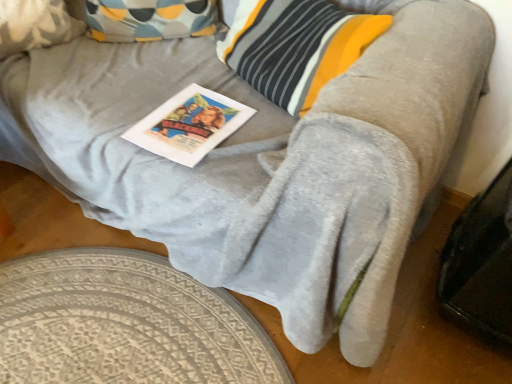
This screenshot has height=384, width=512. In order to click on free spot above textured beige rug at lower left (from a real-world perspective) in this screenshot , I will do `click(133, 317)`.